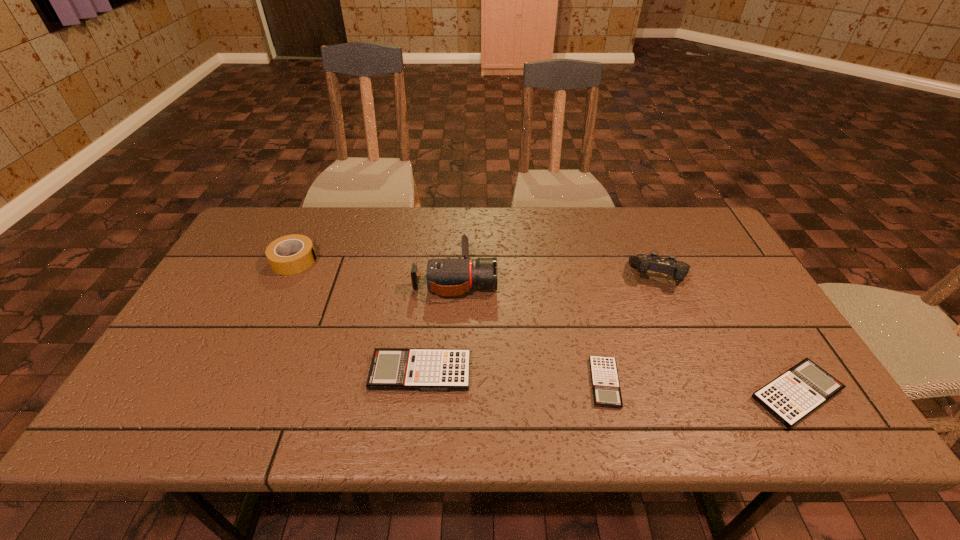
Identify the location of the leftmost calculator. The image size is (960, 540). (391, 368).

Where is `the shortest object`? This screenshot has height=540, width=960. the shortest object is located at coordinates (606, 390).

Identify the location of the third object from right to left. This screenshot has height=540, width=960. (606, 390).

Identify the location of the second shortest object. (792, 396).

What are the coordinates of `the rightmost calculator` in the screenshot? It's located at [x=792, y=396].

Where is `the leftmost object`? This screenshot has height=540, width=960. the leftmost object is located at coordinates (276, 252).

This screenshot has height=540, width=960. I want to click on duct tape, so click(x=276, y=252).

You are a GUI agent. You are given a task and a screenshot of the screen. Output one action in this format:
    pyautogui.click(x=<x>, y=<y>)
    Task: Click on the camcorder
    
    Given the screenshot: What is the action you would take?
    pyautogui.click(x=447, y=277)

The height and width of the screenshot is (540, 960). Identify the location of the second object from right to left. (652, 262).

Locate an element on the screen. Image resolution: width=960 pixels, height=540 pixels. control is located at coordinates (652, 262).